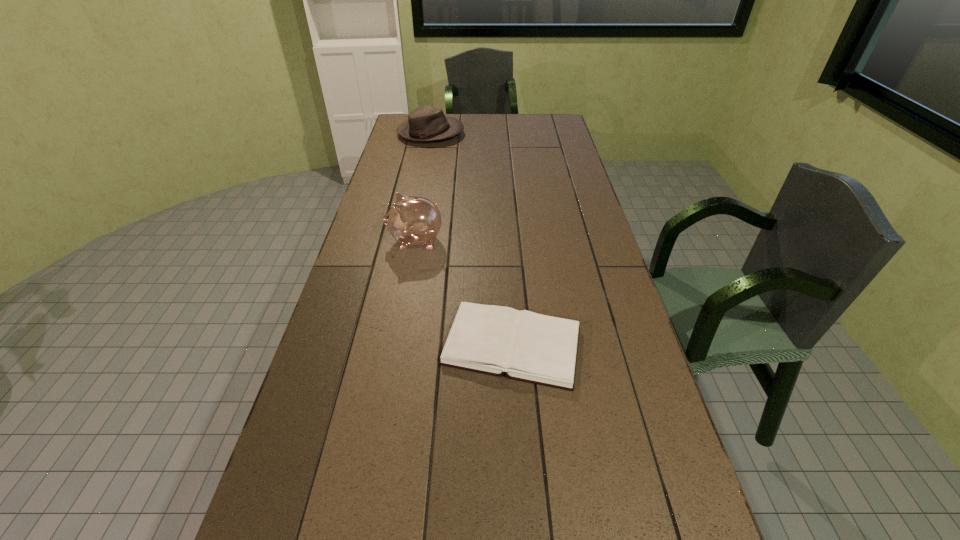
The image size is (960, 540). I want to click on piggy bank, so (412, 220).

The height and width of the screenshot is (540, 960). I want to click on the second farthest object, so click(x=412, y=220).

You are a GUI agent. You are given a task and a screenshot of the screen. Output one action in this format:
    pyautogui.click(x=<x>, y=<y>)
    Task: Click on the hat
    The width and height of the screenshot is (960, 540).
    Given the screenshot: What is the action you would take?
    pyautogui.click(x=426, y=123)

You are a GUI agent. You are given a task and a screenshot of the screen. Output one action in this format:
    pyautogui.click(x=<x>, y=<y>)
    Task: Click on the farthest object
    The height and width of the screenshot is (540, 960).
    Given the screenshot: What is the action you would take?
    pyautogui.click(x=426, y=123)

Where is `the nearest object`? the nearest object is located at coordinates (526, 346).

Where is `the shortest object`? This screenshot has width=960, height=540. the shortest object is located at coordinates (526, 346).

Identify the location of vacant area situated on the decorative side of the second shortest object. The image size is (960, 540). (544, 134).

Locate an element on the screen. blank area located 0.320m on the left of the hardback book is located at coordinates (321, 346).

Locate an element on the screen. This screenshot has width=960, height=540. object present at the far edge is located at coordinates (426, 123).

The image size is (960, 540). I want to click on piggy bank situated at the left edge, so click(x=412, y=220).